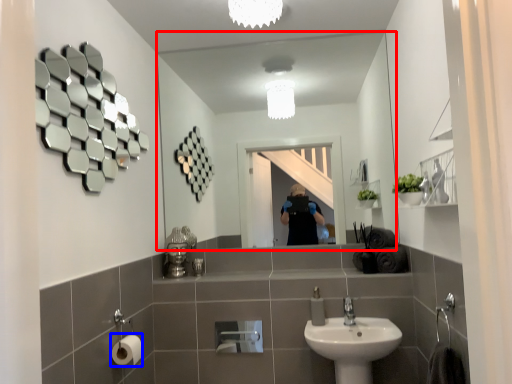
Question: Among these objects, which one is farthest to the camera, mirror (highlighted by a red box) or toilet paper (highlighted by a blue box)?

Choices:
 (A) mirror
 (B) toilet paper

Answer: (A)